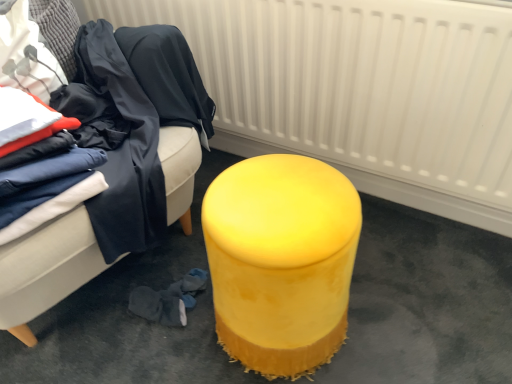
This screenshot has width=512, height=384. Find the location of `free spot to the right of yellow velvet ottoman at center`. free spot to the right of yellow velvet ottoman at center is located at coordinates (393, 326).